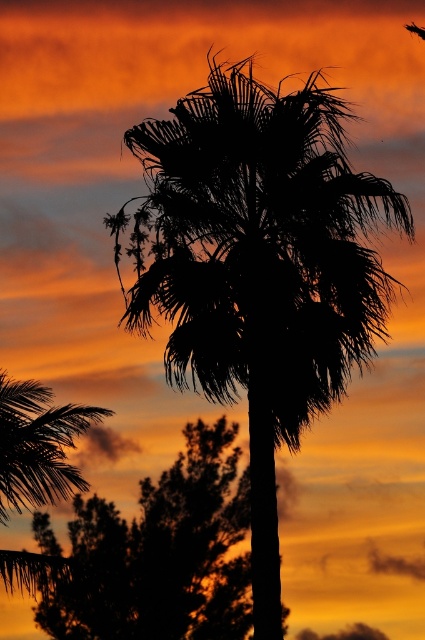
Question: Does black silhouette palm tree at center have a larger size compared to silky black palm tree at upper left?

Choices:
 (A) no
 (B) yes

Answer: (A)

Question: Which is farther from the silhouette leafy tree at center?

Choices:
 (A) black silhouette palm tree at center
 (B) silky black palm tree at upper left

Answer: (A)

Question: Does silhouette leafy tree at center have a greater width compared to silky black palm tree at upper left?

Choices:
 (A) yes
 (B) no

Answer: (A)

Question: Which point is farther to the camera?

Choices:
 (A) (268, 115)
 (B) (164, 525)
 (C) (17, 586)

Answer: (B)

Question: Is black silhouette palm tree at center positioned behind silky black palm tree at upper left?

Choices:
 (A) no
 (B) yes

Answer: (A)

Question: Among these objects, which one is farthest from the camera?

Choices:
 (A) black silhouette palm tree at center
 (B) silky black palm tree at upper left

Answer: (B)